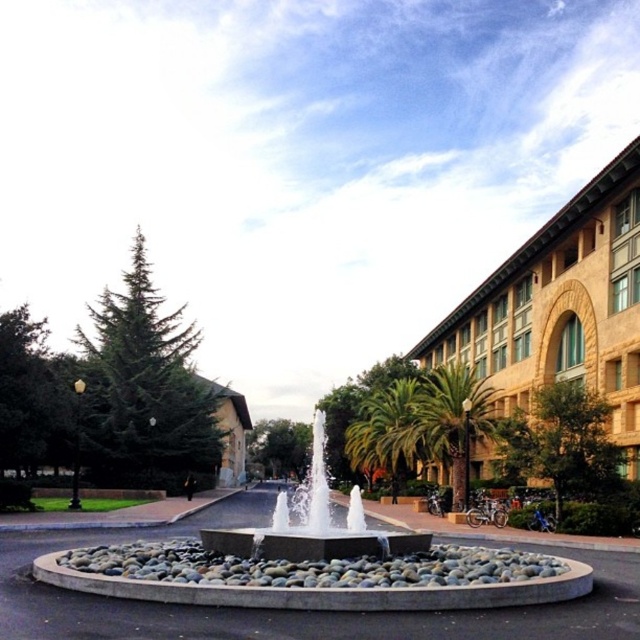
You are standing at the edge of the circular stone platform and want to take a photo of the gray concrete fountain at center and the green leafy palm tree at center. Which object should you position to your right side to capture both in the frame?

You should position the green leafy palm tree at center to your right side because the gray concrete fountain at center is to the left of it, allowing both objects to be included in the photo frame.